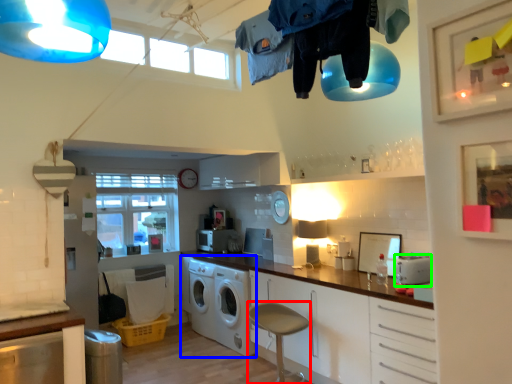
Question: Considering the real-world distances, which object is farthest from bar stool (highlighted by a red box)? washing machine (highlighted by a blue box) or appliance (highlighted by a green box)?

Choices:
 (A) washing machine
 (B) appliance

Answer: (B)